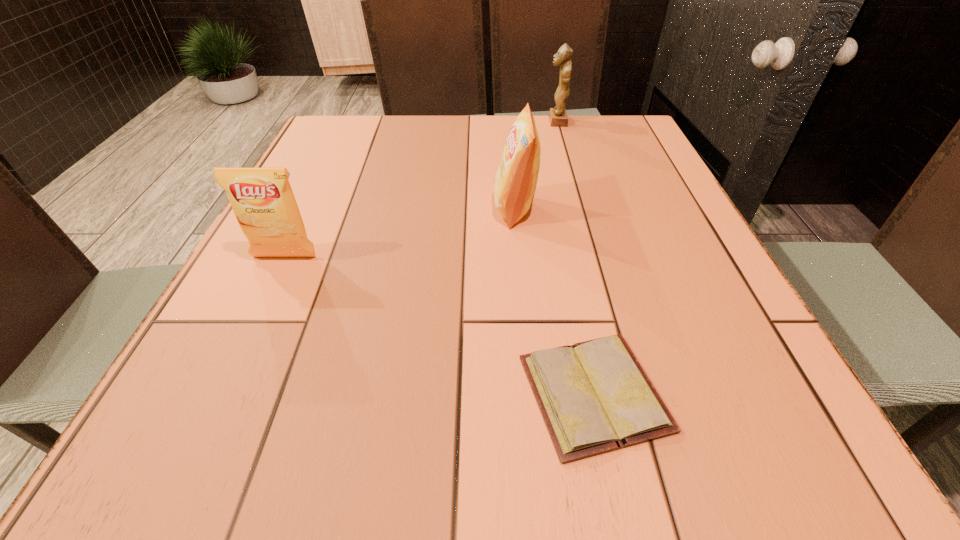
You are a GUI agent. You are given a task and a screenshot of the screen. Output one action in this format:
    pyautogui.click(x=<x>, y=<y>)
    Task: Click on the empty space that is in between the farther crisp (potato chip) and the diary
    This screenshot has width=960, height=540.
    Given the screenshot: What is the action you would take?
    pyautogui.click(x=554, y=301)

Identify which object is located as the nearest to the left crisp (potato chip). Please provide its 2D coordinates. Your answer should be formatted as a tuple, i.e. [(x, y)], where the tuple contains the x and y coordinates of a point satisfying the conditions above.

[(515, 182)]

What are the coordinates of `the closest object to the shortest object` in the screenshot? It's located at (515, 182).

Where is `free region that satisfies the following two spatial constraints: 1. on the front-facing side of the farther crisp (potato chip); 2. on the left side of the nearest object`? The height and width of the screenshot is (540, 960). free region that satisfies the following two spatial constraints: 1. on the front-facing side of the farther crisp (potato chip); 2. on the left side of the nearest object is located at coordinates (532, 393).

Find the location of a particular element. The image size is (960, 540). free space that satisfies the following two spatial constraints: 1. on the front-facing side of the farther crisp (potato chip); 2. on the front of the nearer crisp (potato chip) with the logo is located at coordinates click(x=519, y=257).

At what (x,y) coordinates should I click in order to perform the action: click on free space that satisfies the following two spatial constraints: 1. on the front of the nearest object with the logo; 2. on the left side of the third farthest object. Please return your answer as a coordinate pair (x, y). The width and height of the screenshot is (960, 540). Looking at the image, I should click on (220, 393).

Locate an element on the screen. The height and width of the screenshot is (540, 960). free spot that satisfies the following two spatial constraints: 1. on the front-facing side of the nearest object; 2. on the left side of the farther crisp (potato chip) is located at coordinates (532, 393).

Locate an element on the screen. The image size is (960, 540). vacant space that satisfies the following two spatial constraints: 1. on the front-facing side of the third nearest object; 2. on the front of the nearer crisp (potato chip) with the logo is located at coordinates (519, 257).

Image resolution: width=960 pixels, height=540 pixels. I want to click on vacant area that satisfies the following two spatial constraints: 1. on the front-facing side of the right crisp (potato chip); 2. on the front of the leftmost object with the logo, so click(x=519, y=257).

At what (x,y) coordinates should I click in order to perform the action: click on vacant region that satisfies the following two spatial constraints: 1. on the front of the shortest object with the logo; 2. on the right side of the left crisp (potato chip). Please return your answer as a coordinate pair (x, y). Looking at the image, I should click on (220, 393).